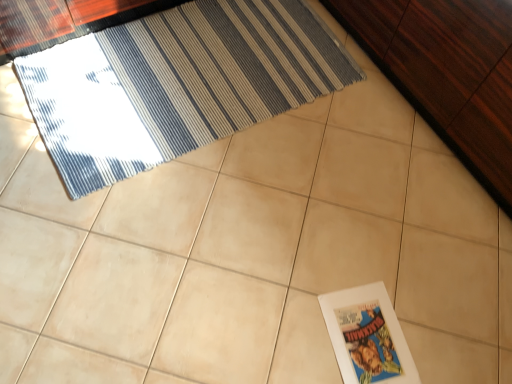
You are a GUI agent. You are given a task and a screenshot of the screen. Output one action in this format:
    pyautogui.click(x=<x>, y=<y>)
    Task: Click on the vacant space in front of blue striped rug at upper left
    The height and width of the screenshot is (384, 512).
    Given the screenshot: What is the action you would take?
    pyautogui.click(x=155, y=251)